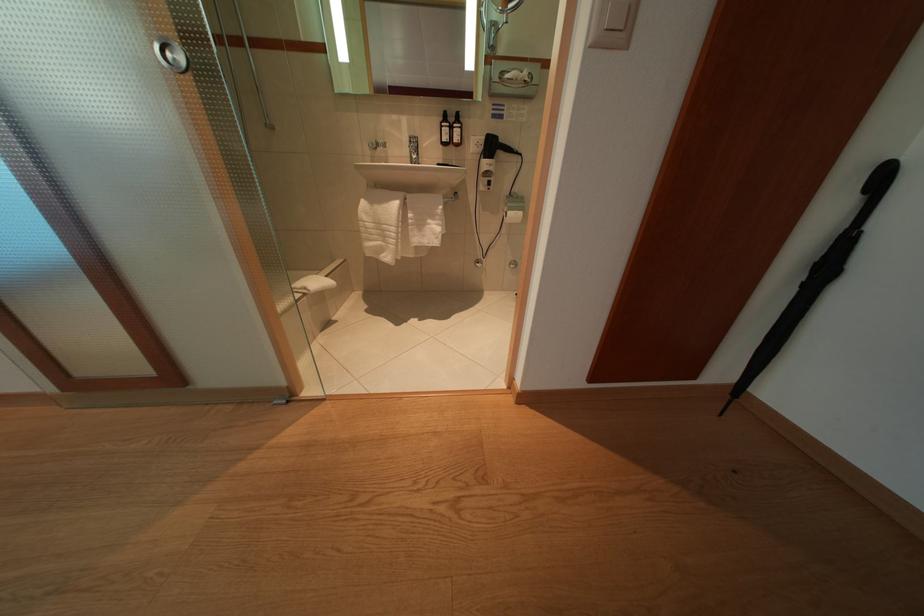
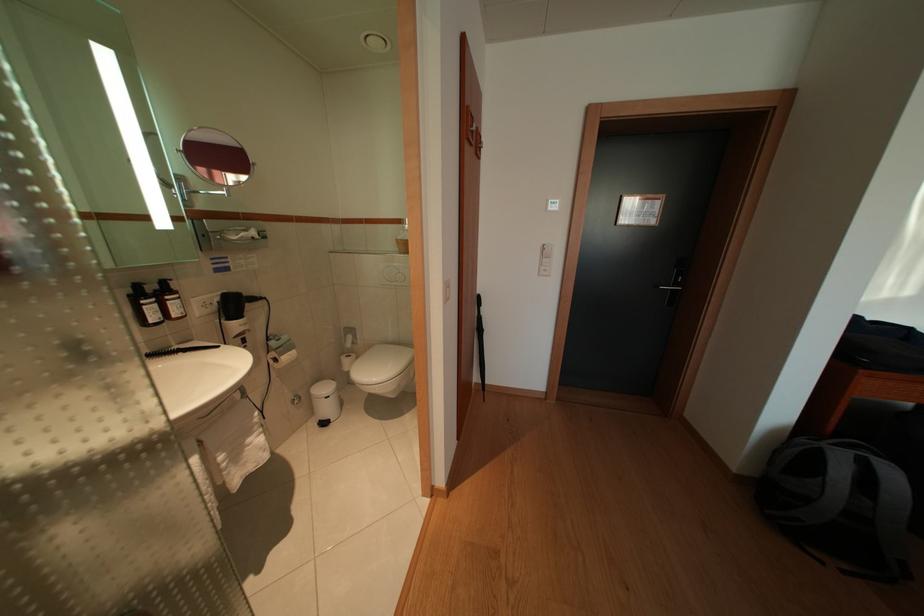
In the second image, find the point that corresponds to (x=455, y=137) in the first image.

(159, 315)